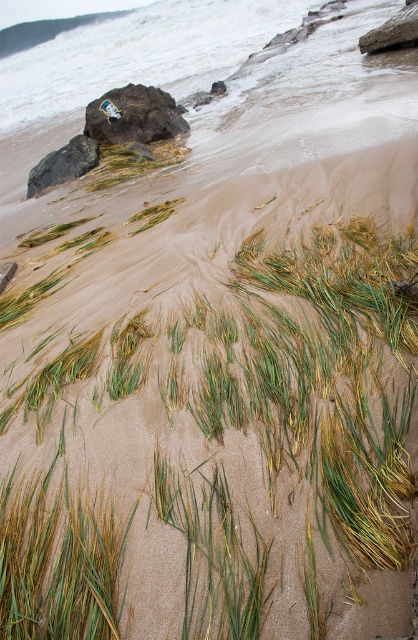
Question: Which point is farther from the camera taking this photo?

Choices:
 (A) (86, 154)
 (B) (106, 122)

Answer: (B)

Question: Is rusty metallic rock at upper left below dark gray rock at left?

Choices:
 (A) yes
 (B) no

Answer: (B)

Question: Does rusty metallic rock at upper left appear under dark gray rock at left?

Choices:
 (A) no
 (B) yes

Answer: (A)

Question: Is rusty metallic rock at upper left closer to the viewer compared to dark gray rock at left?

Choices:
 (A) yes
 (B) no

Answer: (B)

Question: Which point appears farthest from the camera in this image?

Choices:
 (A) (68, 148)
 (B) (91, 129)

Answer: (B)